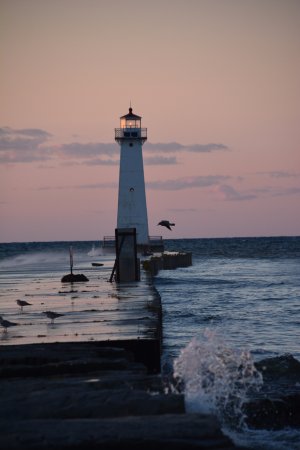
Find the location of a particular element. The width and height of the screenshot is (300, 450). window is located at coordinates click(122, 122), click(128, 121), click(137, 121).